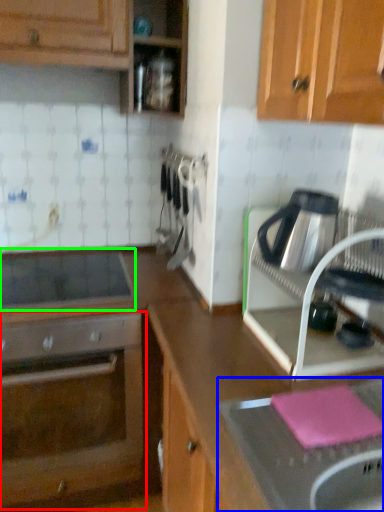
Question: Considering the real-world distances, which object is farthest from oven (highlighted by a red box)? sink (highlighted by a blue box) or home appliance (highlighted by a green box)?

Choices:
 (A) sink
 (B) home appliance

Answer: (A)